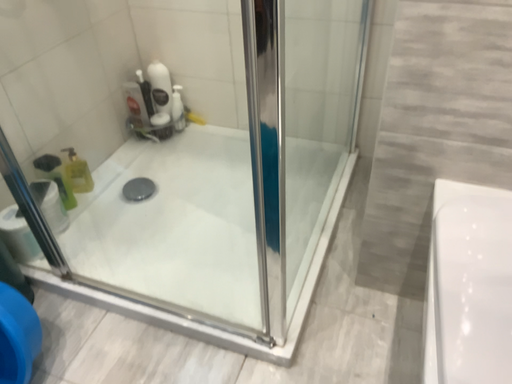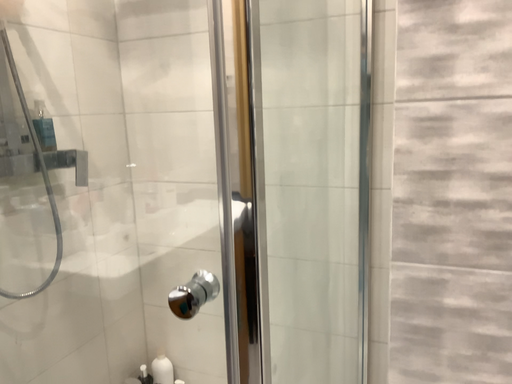
Question: How did the camera likely rotate when shooting the video?

Choices:
 (A) rotated downward
 (B) rotated upward

Answer: (B)